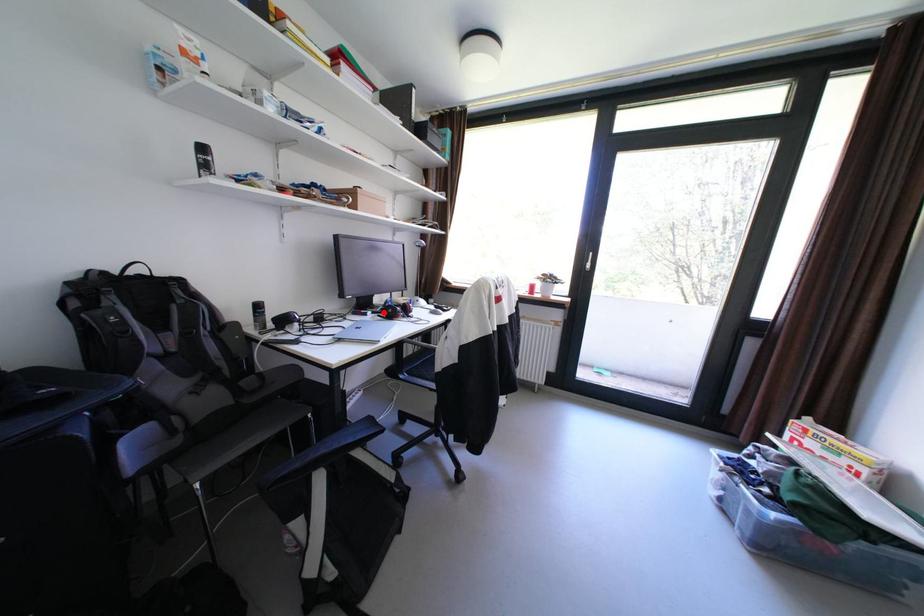
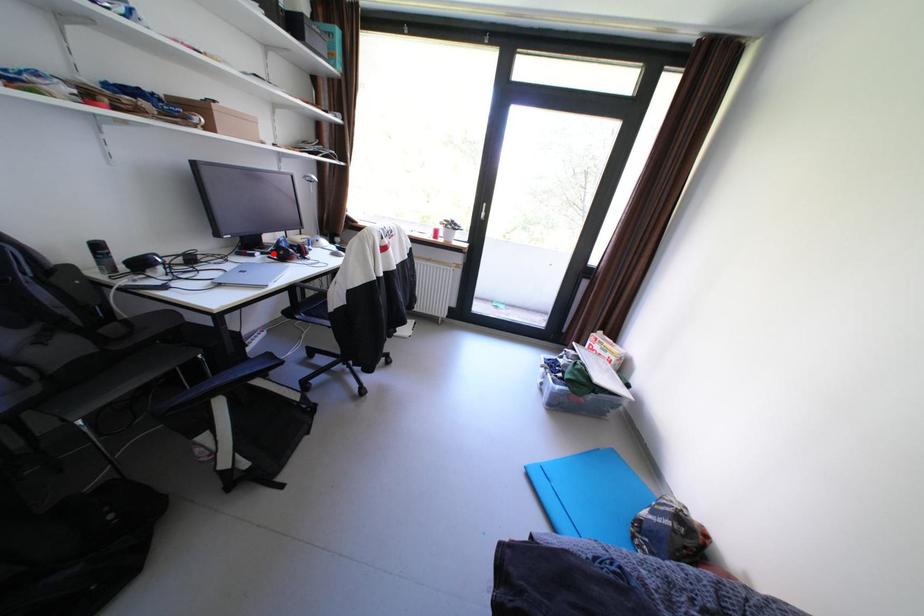
I am providing you with two images of the same scene from different viewpoints. A red point is marked on the first image and another point is marked on the second image. Is the marked point in image1 the same physical position as the marked point in image2?

Yes